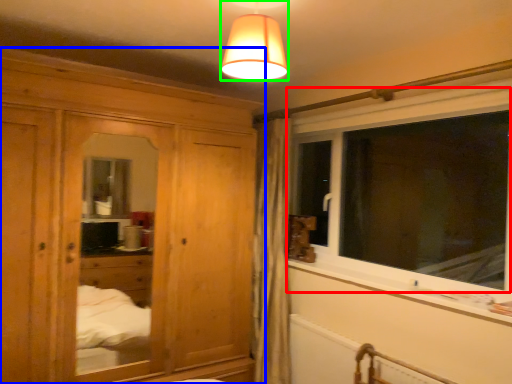
Question: Which object is positioned closest to window (highlighted by a red box)? Select from cabinetry (highlighted by a blue box) and lamp (highlighted by a green box).

Choices:
 (A) cabinetry
 (B) lamp

Answer: (A)